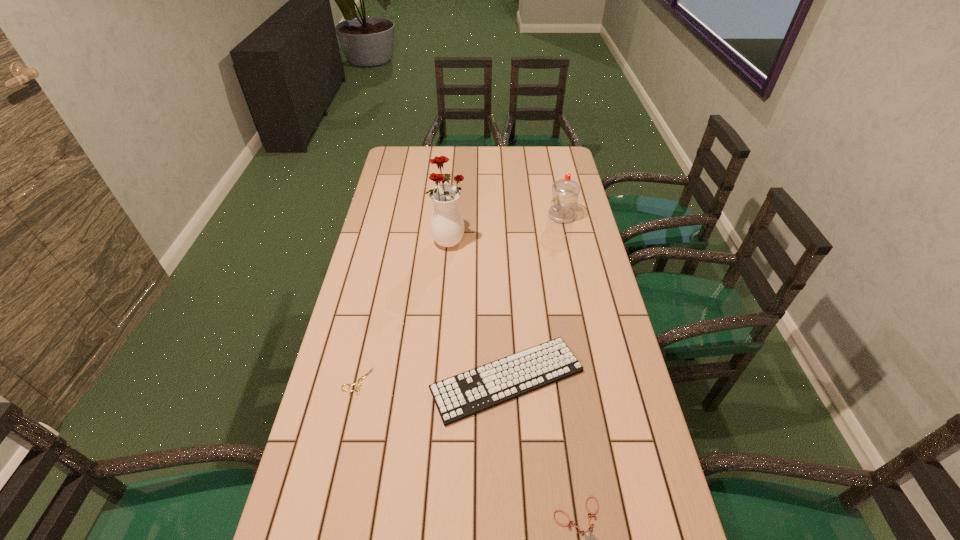
You are a GUI agent. You are given a task and a screenshot of the screen. Output one action in this format:
    pyautogui.click(x=<x>, y=<y>)
    Task: Click on the fourth nearest object
    This screenshot has height=540, width=960.
    Given the screenshot: What is the action you would take?
    pyautogui.click(x=447, y=225)

What are the coordinates of `vase` in the screenshot? It's located at 447,225.

What are the coordinates of `the fourth shortest object` in the screenshot? It's located at (565, 192).

Locate an element on the screen. The width and height of the screenshot is (960, 540). the farthest object is located at coordinates (565, 192).

At what (x,y) coordinates should I click in order to perform the action: click on computer keyboard. Please return your answer as a coordinate pair (x, y). The width and height of the screenshot is (960, 540). Looking at the image, I should click on (458, 397).

Locate an element on the screen. Image resolution: width=960 pixels, height=540 pixels. the left shears is located at coordinates (359, 380).

Where is `the farther shears`? Image resolution: width=960 pixels, height=540 pixels. the farther shears is located at coordinates (359, 380).

Locate an element on the screen. The width and height of the screenshot is (960, 540). free space located 0.370m on the front of the tallest object is located at coordinates (442, 333).

At what (x,y) coordinates should I click in order to perform the action: click on free region located 0.070m on the handle side of the fourth shortest object. Please return your answer as a coordinate pair (x, y). Image resolution: width=960 pixels, height=540 pixels. Looking at the image, I should click on pos(531,216).

At what (x,y) coordinates should I click in order to perform the action: click on free region located on the handle side of the fourth shortest object. Please return your answer as a coordinate pair (x, y). The height and width of the screenshot is (540, 960). Looking at the image, I should click on (462, 216).